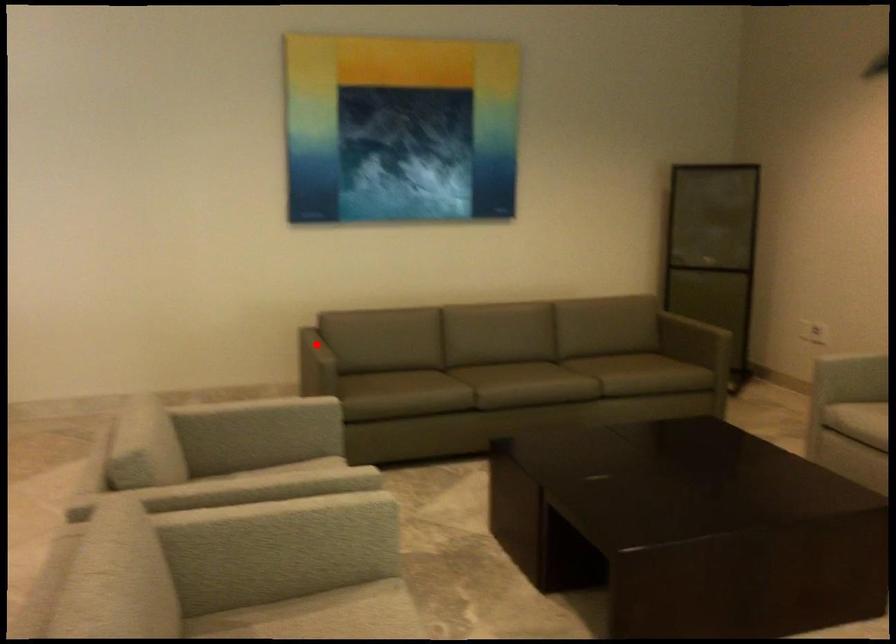
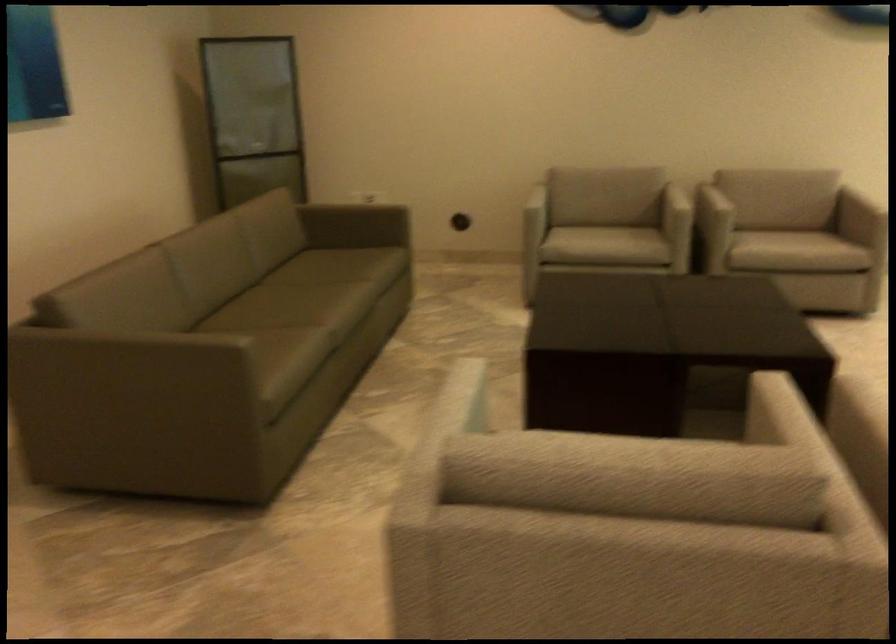
Find the pixel in the second image that matches the highlighted location in the first image.

(133, 337)